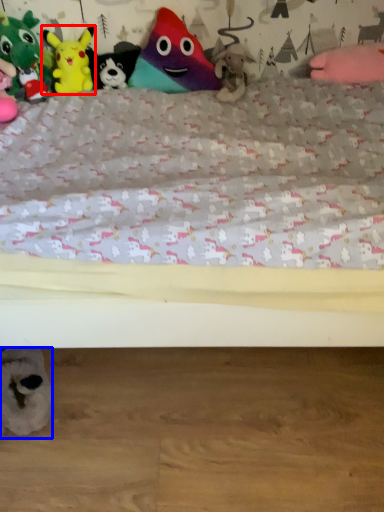
Question: Among these objects, which one is farthest to the camera, toy (highlighted by a red box) or toy (highlighted by a blue box)?

Choices:
 (A) toy
 (B) toy

Answer: (A)